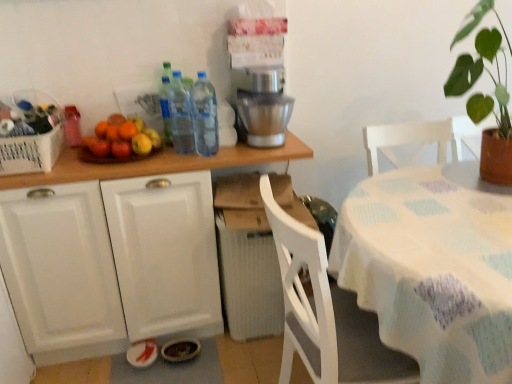
Question: Considering the relative sizes of matte glass bottle at upper left, arranged as the 3th bottle when viewed from the right, and white fabric table at right in the image provided, is matte glass bottle at upper left, arranged as the 3th bottle when viewed from the right, thinner than white fabric table at right?

Choices:
 (A) no
 (B) yes

Answer: (B)

Question: From a real-world perspective, is matte glass bottle at upper left, marked as the first bottle in a left-to-right arrangement, positioned over white fabric table at right based on gravity?

Choices:
 (A) no
 (B) yes

Answer: (B)

Question: Is matte glass bottle at upper left, marked as the first bottle in a left-to-right arrangement, looking in the opposite direction of white fabric table at right?

Choices:
 (A) no
 (B) yes

Answer: (A)

Question: Could white fabric table at right be considered to be inside matte glass bottle at upper left, marked as the first bottle in a left-to-right arrangement?

Choices:
 (A) yes
 (B) no

Answer: (B)

Question: From the image's perspective, is matte glass bottle at upper left, arranged as the 3th bottle when viewed from the right, under white fabric table at right?

Choices:
 (A) yes
 (B) no

Answer: (B)

Question: In terms of size, does white fabric table at right appear bigger or smaller than satin silver coffee machine at upper center?

Choices:
 (A) big
 (B) small

Answer: (A)

Question: From a real-world perspective, is white fabric table at right above or below satin silver coffee machine at upper center?

Choices:
 (A) below
 (B) above

Answer: (A)

Question: Considering the positions of white fabric table at right and satin silver coffee machine at upper center in the image, is white fabric table at right wider or thinner than satin silver coffee machine at upper center?

Choices:
 (A) thin
 (B) wide

Answer: (B)

Question: From the image's perspective, is white fabric table at right located above or below satin silver coffee machine at upper center?

Choices:
 (A) below
 (B) above

Answer: (A)

Question: From the image's perspective, is white wood cabinet at upper left located above or below satin silver coffee machine at upper center?

Choices:
 (A) above
 (B) below

Answer: (B)

Question: Considering the positions of white wood cabinet at upper left and satin silver coffee machine at upper center in the image, is white wood cabinet at upper left taller or shorter than satin silver coffee machine at upper center?

Choices:
 (A) tall
 (B) short

Answer: (A)

Question: Considering the relative positions of white wood cabinet at upper left and satin silver coffee machine at upper center in the image provided, is white wood cabinet at upper left to the left or to the right of satin silver coffee machine at upper center?

Choices:
 (A) left
 (B) right

Answer: (A)

Question: Is white wood cabinet at upper left bigger or smaller than satin silver coffee machine at upper center?

Choices:
 (A) small
 (B) big

Answer: (B)

Question: Is shiny plastic fruits at center left inside or outside of translucent plastic bottles at upper center, which is the second bottle in left-to-right order?

Choices:
 (A) outside
 (B) inside

Answer: (A)

Question: From the image's perspective, is shiny plastic fruits at center left above or below translucent plastic bottles at upper center, which is the second bottle in left-to-right order?

Choices:
 (A) below
 (B) above

Answer: (A)